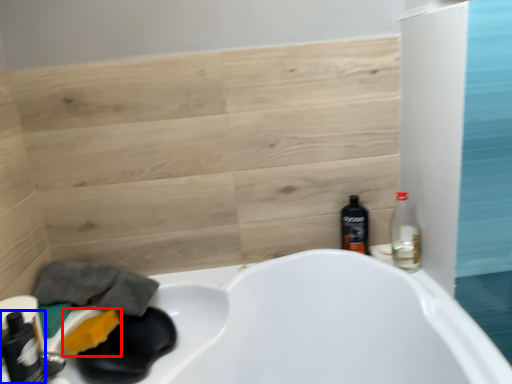
Question: Which point is further to the camera, soap (highlighted by a red box) or bottle (highlighted by a blue box)?

Choices:
 (A) soap
 (B) bottle

Answer: (A)